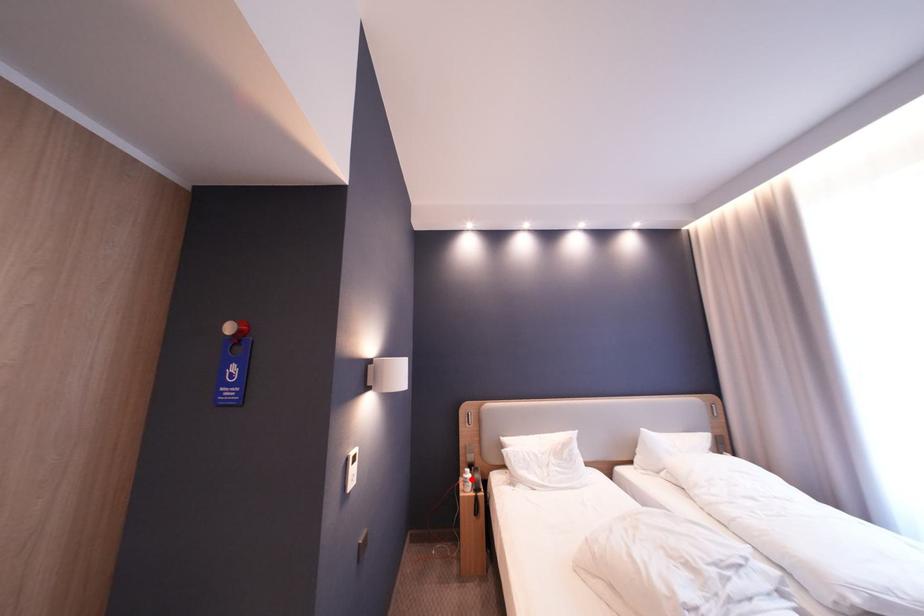
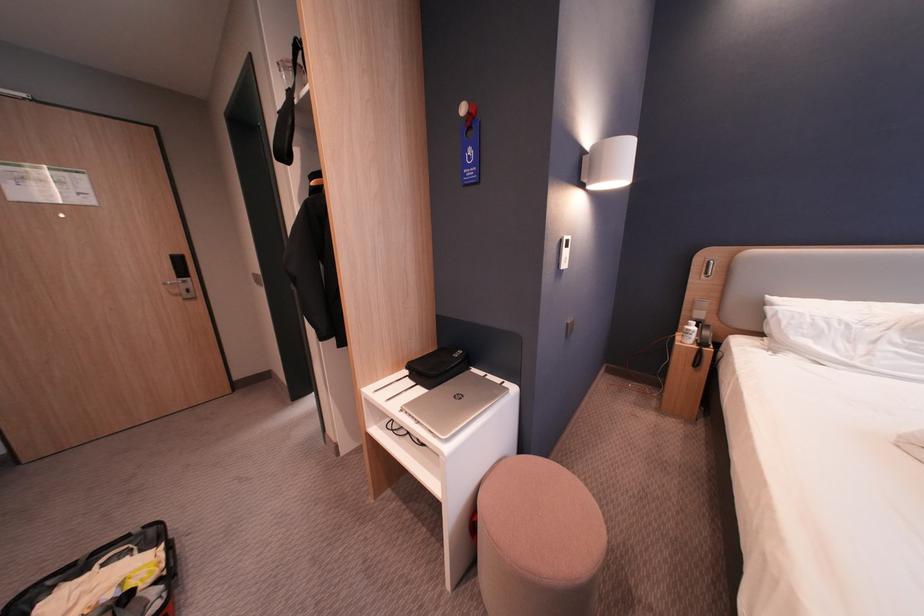
Question: I am providing you with two images of the same scene from different viewpoints. In image1, a red point is highlighted. Considering the same 3D point in image2, which of the following is correct?

Choices:
 (A) It is closer
 (B) It is farther

Answer: (A)